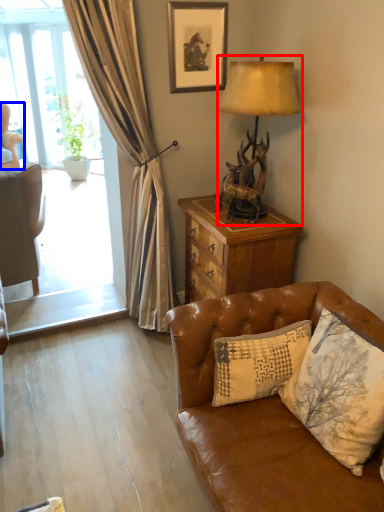
Question: Which object appears closest to the camera in this image, lamp (highlighted by a red box) or chair (highlighted by a blue box)?

Choices:
 (A) lamp
 (B) chair

Answer: (A)